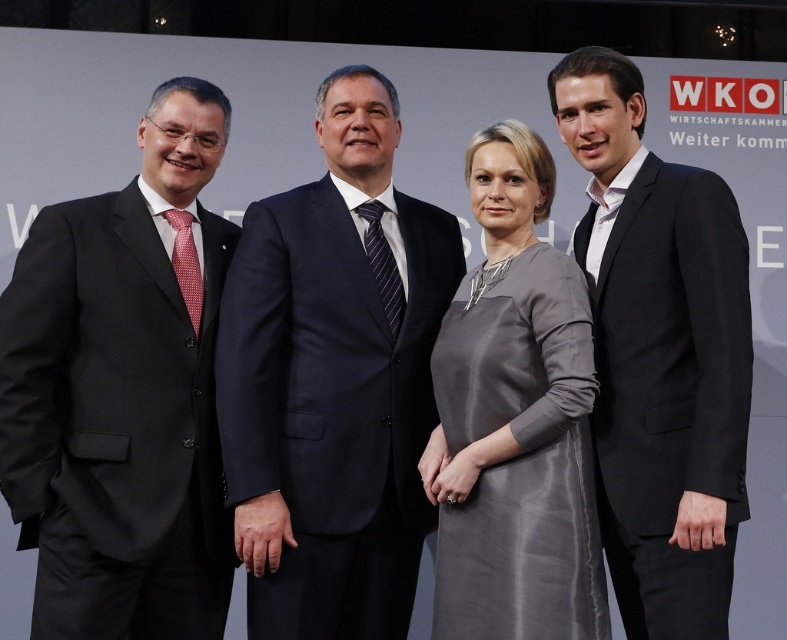
Question: Which point appears farthest from the camera in this image?

Choices:
 (A) (74, 541)
 (B) (490, 403)

Answer: (B)

Question: Which point is closer to the camera?

Choices:
 (A) black suit at right
 (B) satin gray dress at center
 (C) navy blue suit at center

Answer: (A)

Question: Among these points, which one is nearest to the camera?

Choices:
 (A) (558, 113)
 (B) (242, 228)

Answer: (A)

Question: Can you confirm if navy blue suit at center is thinner than satin gray dress at center?

Choices:
 (A) no
 (B) yes

Answer: (A)

Question: Can you confirm if navy blue suit at center is bigger than satin gray dress at center?

Choices:
 (A) yes
 (B) no

Answer: (A)

Question: Considering the relative positions of matte black suit at left and black suit at right in the image provided, where is matte black suit at left located with respect to black suit at right?

Choices:
 (A) below
 (B) above

Answer: (A)